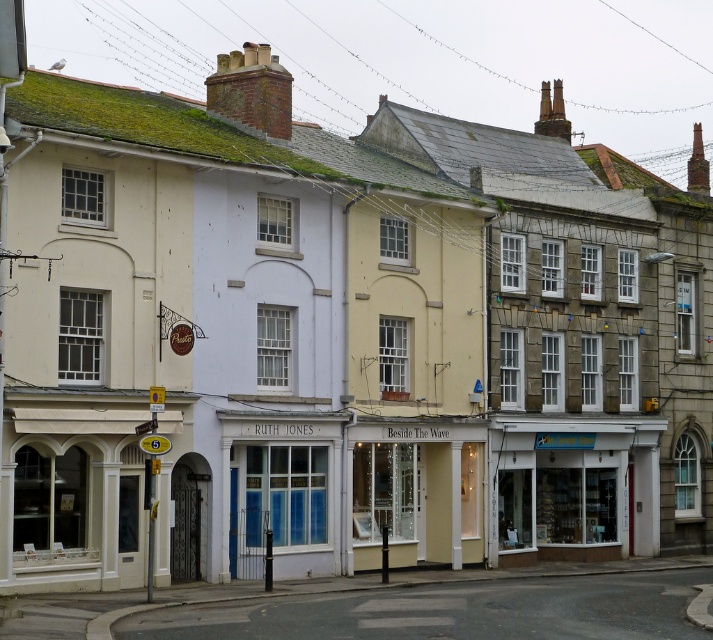
You are a delivery person who needs to deliver a package to the white glass storefront at lower right and the white glass storefront at center. Since you can only deliver to one location today, which one should you choose if you have a large package that requires a bigger delivery area?

You should deliver to the white glass storefront at lower right because it is larger in size than the white glass storefront at center, making it more suitable for handling large packages.

You are a customer looking to enter the white glass storefront at lower right and the white glass storefront at center. Which one has a wider entrance? Please base your answer on the scene description provided.

The white glass storefront at lower right has a wider entrance than the white glass storefront at center because its width surpasses the other.